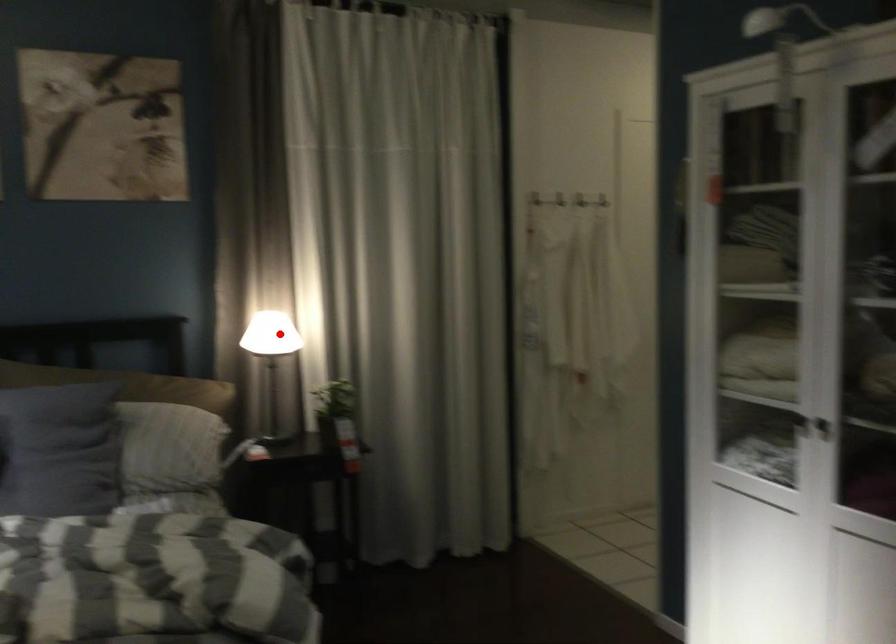
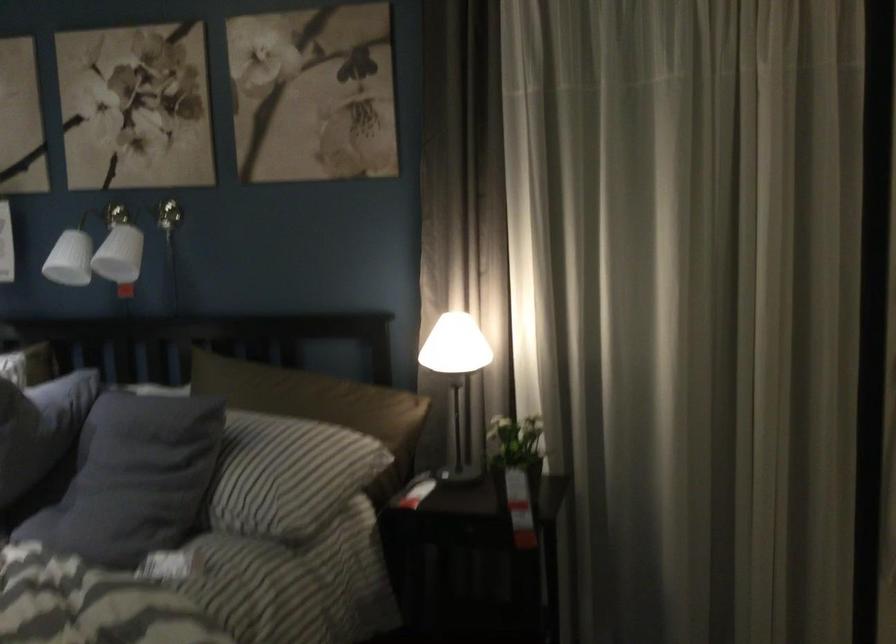
Question: I am providing you with two images of the same scene from different viewpoints. In image1, a red point is highlighted. Considering the same 3D point in image2, which of the following is correct?

Choices:
 (A) It is closer
 (B) It is farther

Answer: (A)